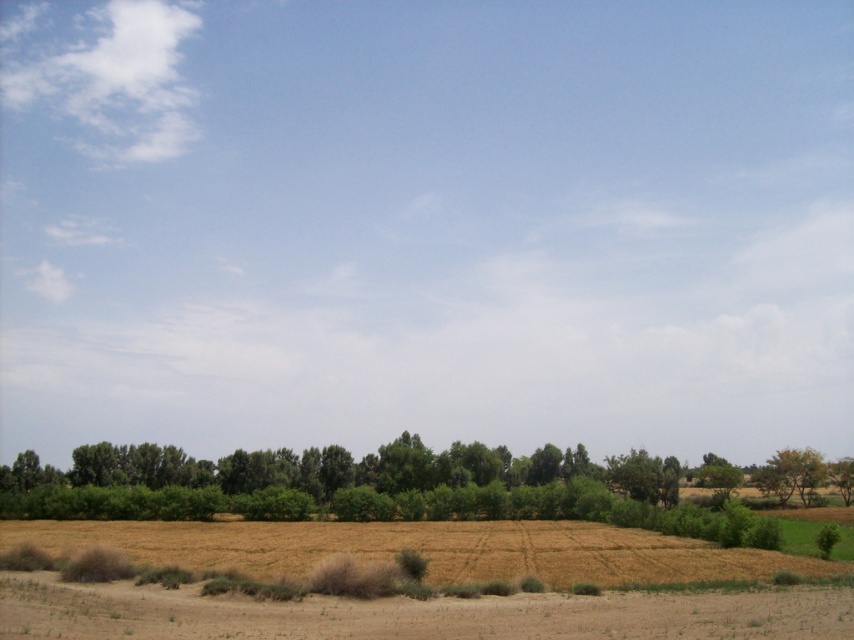
Question: Does green leafy trees at center appear under green leafy tree at right?

Choices:
 (A) yes
 (B) no

Answer: (A)

Question: Which point is farther to the camera?

Choices:
 (A) (781, 465)
 (B) (225, 486)

Answer: (A)

Question: In this image, where is brown dry soil at lower center located relative to green leafy tree at right?

Choices:
 (A) right
 (B) left

Answer: (B)

Question: Which of the following is the farthest from the observer?

Choices:
 (A) green leafy trees at center
 (B) brown dry soil at lower center

Answer: (A)

Question: Does green leafy trees at center lie in front of brown dry soil at lower center?

Choices:
 (A) yes
 (B) no

Answer: (B)

Question: Which object is positioned farthest from the brown dry soil at lower center?

Choices:
 (A) green leafy tree at right
 (B) green leafy trees at center

Answer: (A)